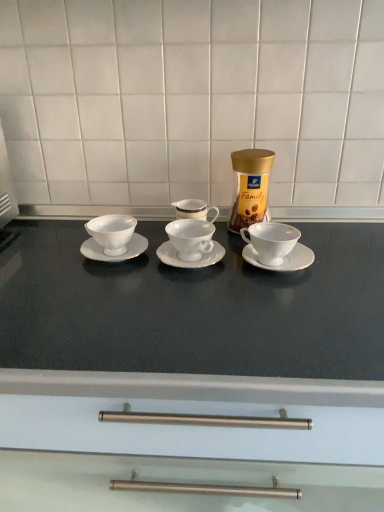
The image size is (384, 512). I want to click on vacant area that lies to the right of gold metallic jar at center, so click(x=330, y=232).